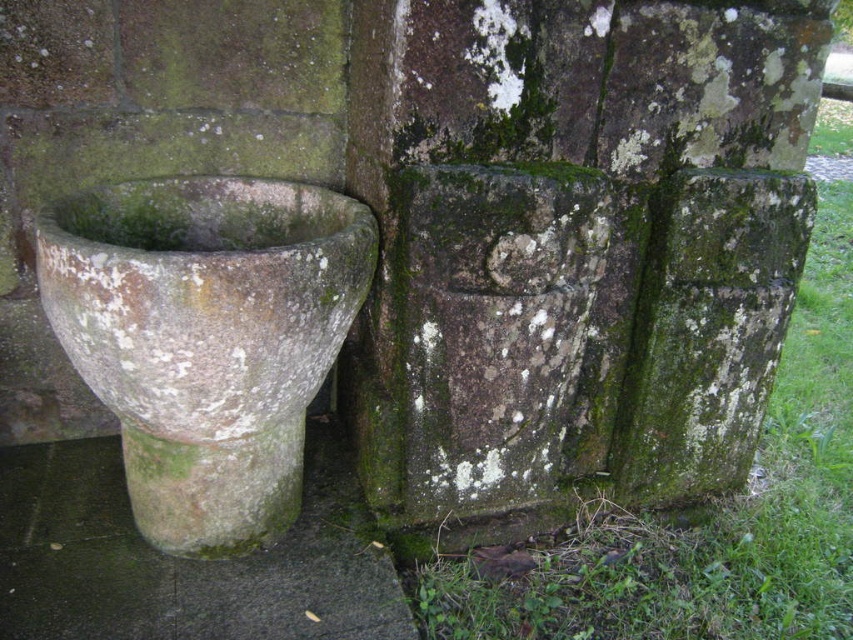
Does point (334, 296) come behind point (155, 566)?

No, it is not.

Measure the distance between speckled stone basin at left and camera.

A distance of 3.76 feet exists between speckled stone basin at left and camera.

You are a GUI agent. You are given a task and a screenshot of the screen. Output one action in this format:
    pyautogui.click(x=<x>, y=<y>)
    Task: Click on the speckled stone basin at left
    
    Given the screenshot: What is the action you would take?
    pyautogui.click(x=206, y=337)

Which is behind, point (494, 301) or point (42, 545)?

The point (42, 545) is behind.

Does green mossy stone at center have a larger size compared to green mossy stone pot at lower left?

Correct, green mossy stone at center is larger in size than green mossy stone pot at lower left.

Who is more forward, [473,490] or [183,566]?

Point [183,566] is in front.

Where is `green mossy stone at center`? green mossy stone at center is located at coordinates (573, 250).

Based on the photo, between green mossy stone at center and speckled stone basin at left, which one appears on the left side from the viewer's perspective?

From the viewer's perspective, speckled stone basin at left appears more on the left side.

Which is behind, point (567, 173) or point (294, 305)?

The point (567, 173) is more distant.

The width and height of the screenshot is (853, 640). In order to click on green mossy stone at center in this screenshot , I will do `click(573, 250)`.

Where is `green mossy stone at center`? The height and width of the screenshot is (640, 853). green mossy stone at center is located at coordinates (573, 250).